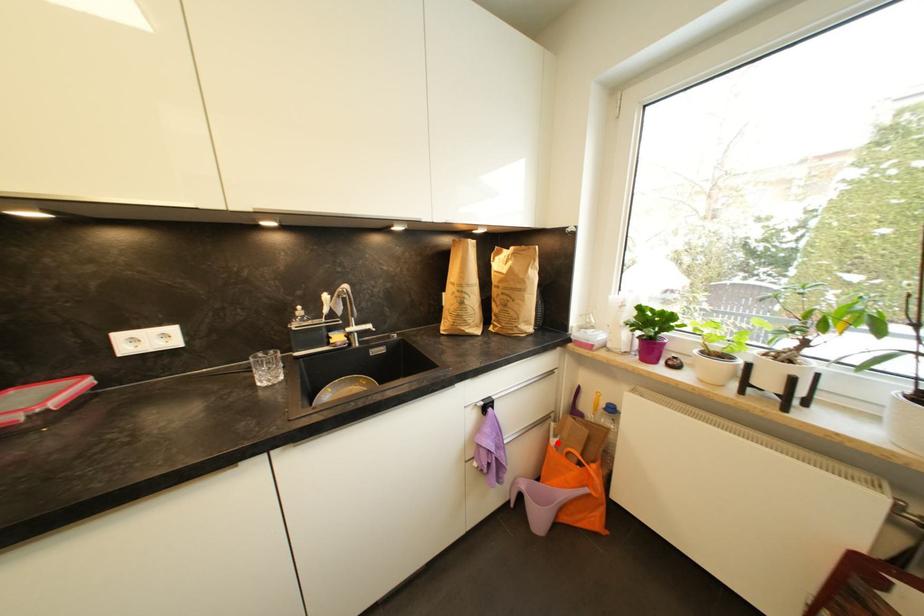
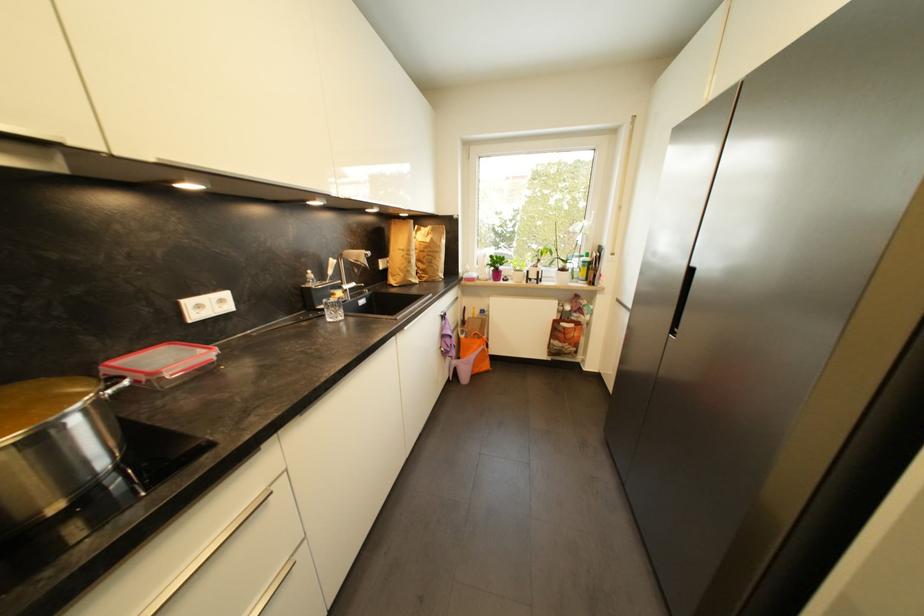
Locate, in the second image, the point that corresponds to the highlighted location in the first image.

(468, 339)